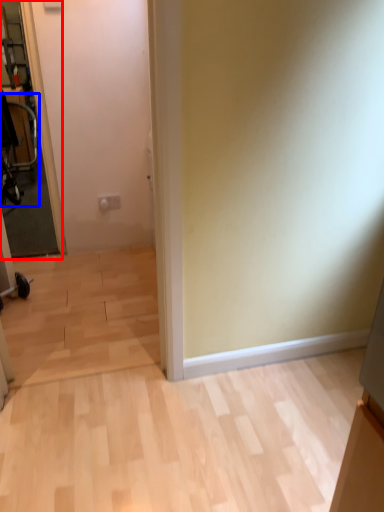
Question: Which object is closer to the camera taking this photo, glass door (highlighted by a red box) or swivel chair (highlighted by a blue box)?

Choices:
 (A) glass door
 (B) swivel chair

Answer: (A)